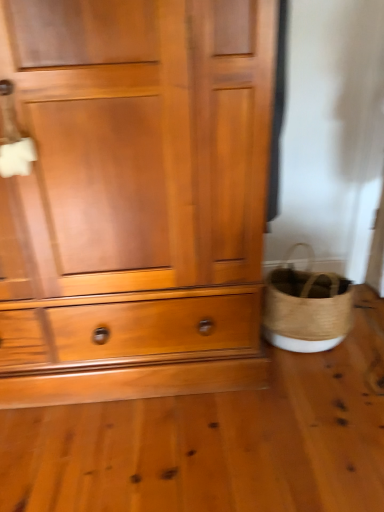
This screenshot has height=512, width=384. Identify the location of matte wood chest of drawers at center. (135, 198).

The width and height of the screenshot is (384, 512). Describe the element at coordinates (135, 198) in the screenshot. I see `matte wood chest of drawers at center` at that location.

The height and width of the screenshot is (512, 384). What are the coordinates of `woven straw basket at lower right` in the screenshot? It's located at (306, 307).

Describe the element at coordinates (306, 307) in the screenshot. This screenshot has width=384, height=512. I see `woven straw basket at lower right` at that location.

Find the location of `matte wood chest of drawers at center`. matte wood chest of drawers at center is located at coordinates (135, 198).

Would you say matte wood chest of drawers at center is to the left or to the right of woven straw basket at lower right in the picture?

Clearly, matte wood chest of drawers at center is on the left of woven straw basket at lower right in the image.

In the scene shown: Which is in front, matte wood chest of drawers at center or woven straw basket at lower right?

matte wood chest of drawers at center is in front.

Does point (187, 61) appear closer or farther from the camera than point (321, 349)?

Point (187, 61).

Looking at this image, from the image's perspective, who appears lower, matte wood chest of drawers at center or woven straw basket at lower right?

woven straw basket at lower right, from the image's perspective.

From a real-world perspective, is matte wood chest of drawers at center under woven straw basket at lower right?

No, from a real-world perspective, matte wood chest of drawers at center is not under woven straw basket at lower right.

Which of these two, matte wood chest of drawers at center or woven straw basket at lower right, is wider?

Wider between the two is matte wood chest of drawers at center.

Between matte wood chest of drawers at center and woven straw basket at lower right, which one has less height?

woven straw basket at lower right is shorter.

Considering the relative sizes of matte wood chest of drawers at center and woven straw basket at lower right in the image provided, is matte wood chest of drawers at center bigger than woven straw basket at lower right?

Yes, matte wood chest of drawers at center is bigger than woven straw basket at lower right.

Is woven straw basket at lower right a part of matte wood chest of drawers at center?

No, woven straw basket at lower right is not inside matte wood chest of drawers at center.

Is matte wood chest of drawers at center touching woven straw basket at lower right?

No, matte wood chest of drawers at center is not making contact with woven straw basket at lower right.

Is matte wood chest of drawers at center facing away from woven straw basket at lower right?

That's not correct — matte wood chest of drawers at center is not looking away from woven straw basket at lower right.

Locate an element on the screen. This screenshot has height=512, width=384. chest of drawers above the woven straw basket at lower right (from a real-world perspective) is located at coordinates (135, 198).

Which is more to the right, woven straw basket at lower right or matte wood chest of drawers at center?

From the viewer's perspective, woven straw basket at lower right appears more on the right side.

Based on the photo, considering their positions, is woven straw basket at lower right located in front of or behind matte wood chest of drawers at center?

Visually, woven straw basket at lower right is located behind matte wood chest of drawers at center.

Which is farther from the camera, (336, 304) or (131, 66)?

The point (336, 304) is behind.

From the image's perspective, is woven straw basket at lower right above or below matte wood chest of drawers at center?

Clearly, from the image's perspective, woven straw basket at lower right is below matte wood chest of drawers at center.

From a real-world perspective, between woven straw basket at lower right and matte wood chest of drawers at center, who is vertically higher?

In real-world perspective, matte wood chest of drawers at center is above.

Which object is wider, woven straw basket at lower right or matte wood chest of drawers at center?

matte wood chest of drawers at center is wider.

From their relative heights in the image, would you say woven straw basket at lower right is taller or shorter than matte wood chest of drawers at center?

woven straw basket at lower right is shorter than matte wood chest of drawers at center.

Is woven straw basket at lower right bigger or smaller than matte wood chest of drawers at center?

Considering their sizes, woven straw basket at lower right takes up less space than matte wood chest of drawers at center.

Is woven straw basket at lower right positioned beyond the bounds of matte wood chest of drawers at center?

Absolutely, woven straw basket at lower right is external to matte wood chest of drawers at center.

Consider the image. Is woven straw basket at lower right next to matte wood chest of drawers at center?

No, woven straw basket at lower right is not with matte wood chest of drawers at center.

Could you tell me if woven straw basket at lower right is facing matte wood chest of drawers at center?

No, woven straw basket at lower right is not facing towards matte wood chest of drawers at center.

You are a GUI agent. You are given a task and a screenshot of the screen. Output one action in this format:
    pyautogui.click(x=<x>, y=<y>)
    Task: Click on the basket below the matte wood chest of drawers at center (from a real-world perspective)
    
    Given the screenshot: What is the action you would take?
    pyautogui.click(x=306, y=307)

This screenshot has width=384, height=512. Identify the location of the chest of drawers in front of the woven straw basket at lower right. click(135, 198).

At what (x,y) coordinates should I click in order to perform the action: click on chest of drawers above the woven straw basket at lower right (from a real-world perspective). Please return your answer as a coordinate pair (x, y). This screenshot has height=512, width=384. Looking at the image, I should click on (135, 198).